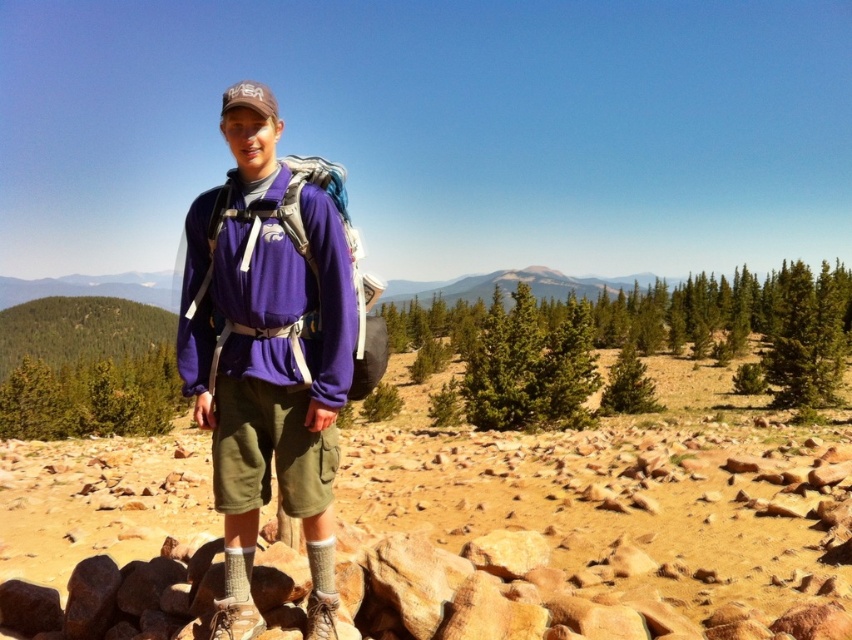
Is point (249, 577) more distant than point (209, 243)?

That is False.

Does purple fleece jacket at center appear on the right side of matte purple backpack at center?

No, purple fleece jacket at center is not to the right of matte purple backpack at center.

Find the location of a particular element. This screenshot has height=640, width=852. purple fleece jacket at center is located at coordinates [x=269, y=348].